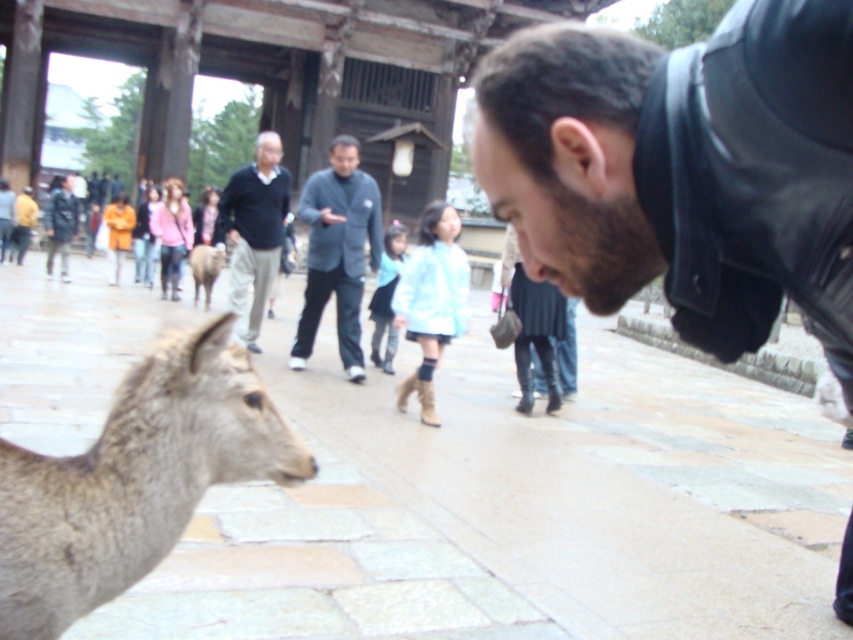
You are a photographer standing in the deer park. You want to take a photo of the gray fur deer at lower left without the black leather jacket at lower right appearing in the background. Can you move far enough away from the deer to ensure the jacket is out of frame? The camera you are using has a standard 50mm lens.

The black leather jacket at lower right is 3.57 feet away from the gray fur deer at lower left. To avoid the jacket in the background, you would need to position yourself such that the distance between you and the deer is greater than the distance between the deer and the jacket. However, since the jacket is only 3.57 feet away from the deer, moving further back might still keep both in the frame depending on the lens. With a standard 50mm lens, the field of view is relatively narrow, so moving about 5 feet

You are standing in the Japanese deer park and see two people wearing dark gray suit at center and dark blue sweater at center. Which one is nearer to you?

The dark gray suit at center is closer to the viewer than the dark blue sweater at center, so the dark gray suit at center is nearer to you.

You are standing at the center of the scene and want to locate the black leather jacket at lower right. Which direction should you look to find it?

You should look to the lower right direction to find the black leather jacket at lower right.